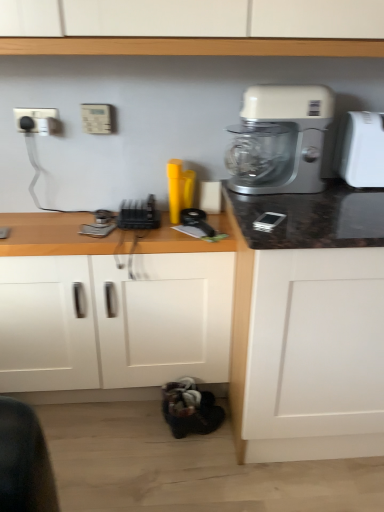
Locate an element on the screen. spots to the right of black plastic toaster at center is located at coordinates (188, 226).